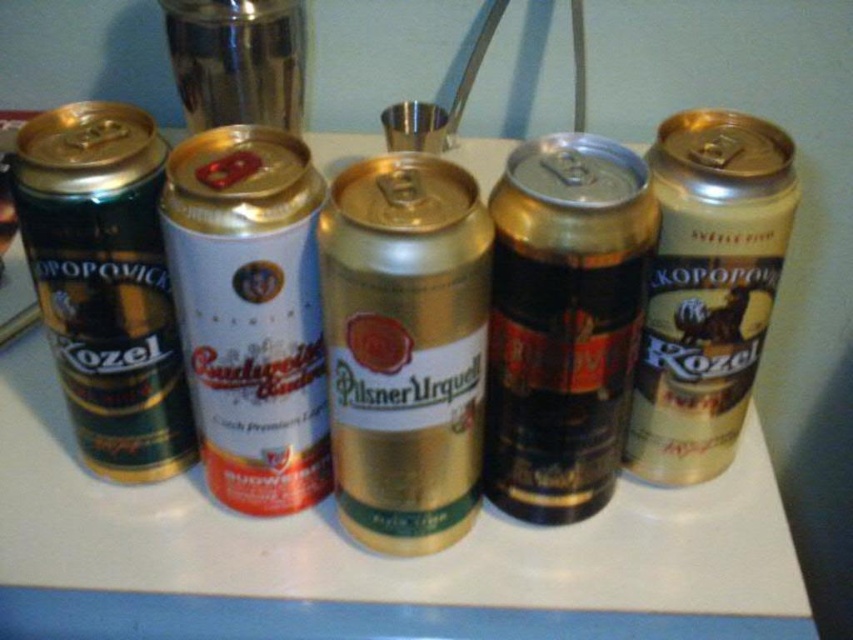
Question: Is gold metallic can at center below gold metallic can at right?

Choices:
 (A) no
 (B) yes

Answer: (B)

Question: Which point is farther to the camera?

Choices:
 (A) (302, 240)
 (B) (514, 305)

Answer: (B)

Question: Can you confirm if white matte can at center is wider than shiny green can at left?

Choices:
 (A) yes
 (B) no

Answer: (B)

Question: Among these points, which one is nearest to the camera?

Choices:
 (A) (315, 417)
 (B) (351, 321)

Answer: (B)

Question: Which object appears farthest from the camera in this image?

Choices:
 (A) shiny green can at left
 (B) gold metallic can at right
 (C) gold metallic can at center
 (D) shiny metallic can at center

Answer: (B)

Question: Is the position of gold metallic can at center more distant than that of white matte can at center?

Choices:
 (A) no
 (B) yes

Answer: (A)